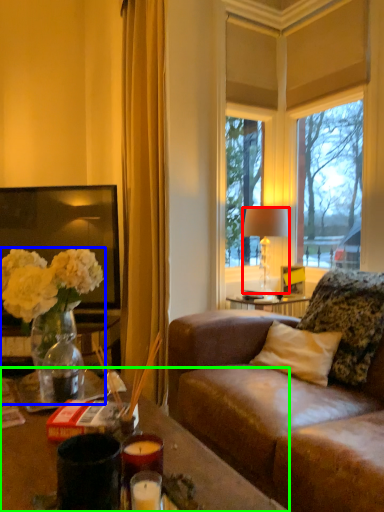
Question: Which object is positioned closest to lamp (highlighted by a red box)? Select from houseplant (highlighted by a blue box) and desk (highlighted by a green box).

Choices:
 (A) houseplant
 (B) desk

Answer: (A)